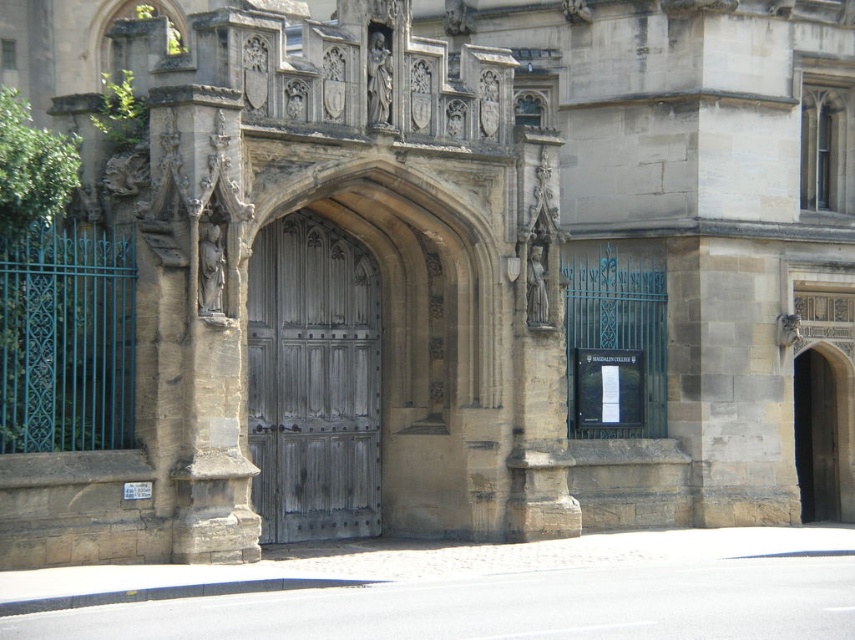
Which is above, wooden carved door at center or weathered wood door at center?

wooden carved door at center is above.

Image resolution: width=855 pixels, height=640 pixels. I want to click on wooden carved door at center, so click(x=372, y=365).